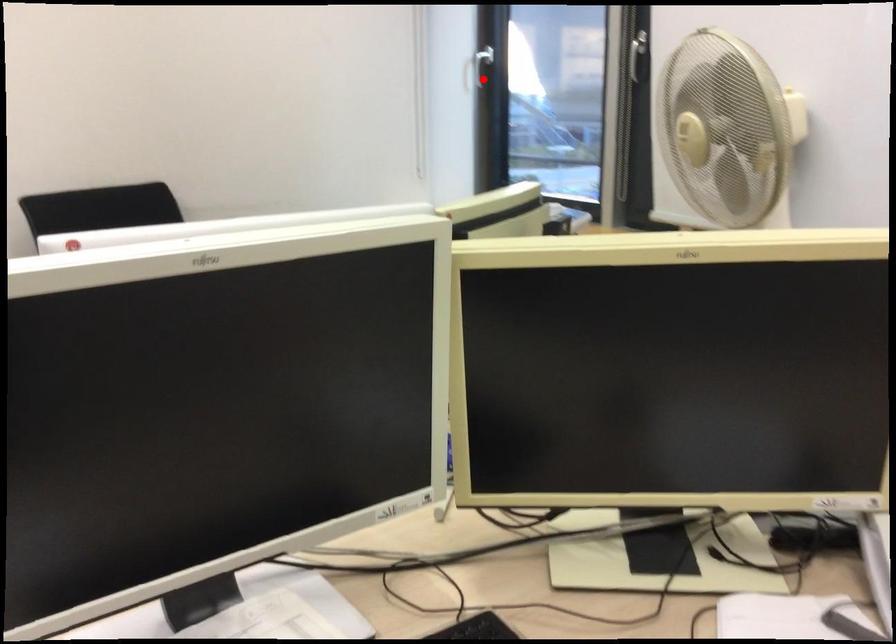
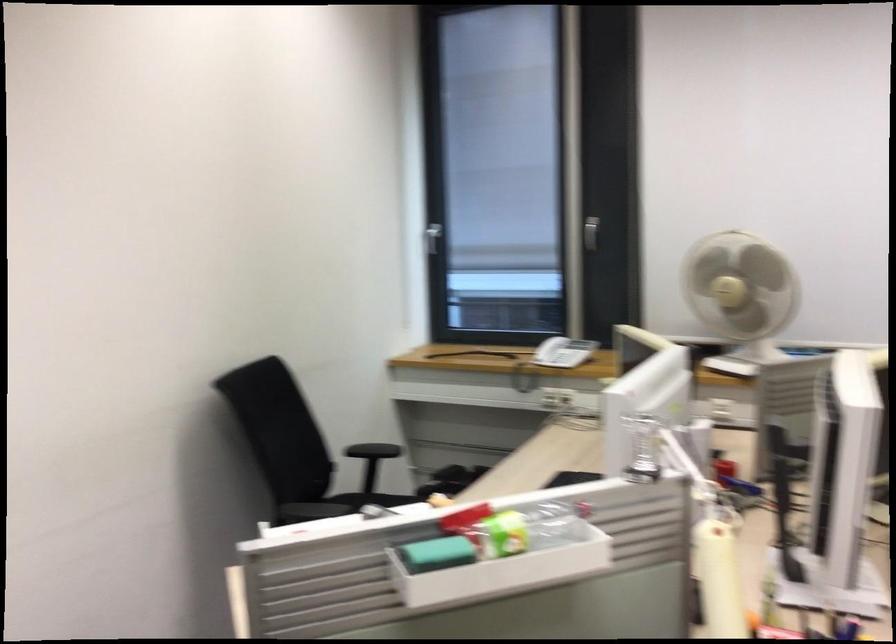
Question: I am providing you with two images of the same scene from different viewpoints. Image1 has a red point marked. In image2, the corresponding 3D location appears at what relative position? Reply with the corresponding letter.

Choices:
 (A) Closer
 (B) Farther

Answer: (B)